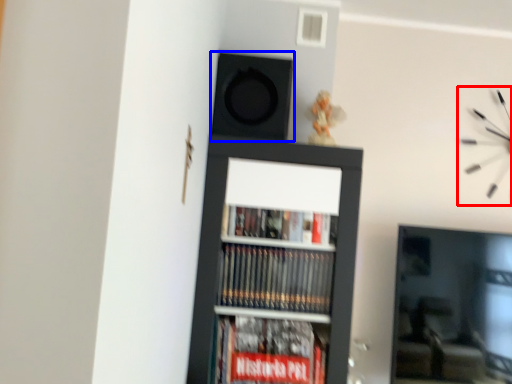
Question: Which point is closer to the camera, clock (highlighted by a red box) or speaker (highlighted by a blue box)?

Choices:
 (A) clock
 (B) speaker

Answer: (B)